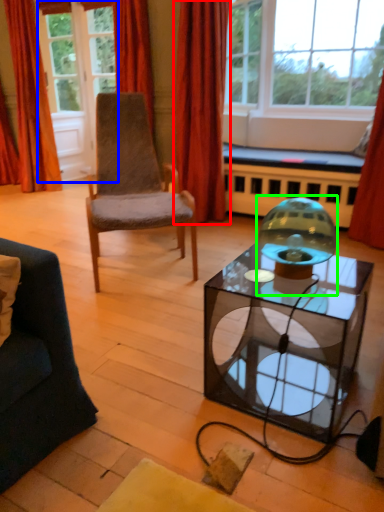
Question: Which is nearer to the curtain (highlighted by a red box)? glass door (highlighted by a blue box) or candle holder (highlighted by a green box).

Choices:
 (A) glass door
 (B) candle holder

Answer: (A)